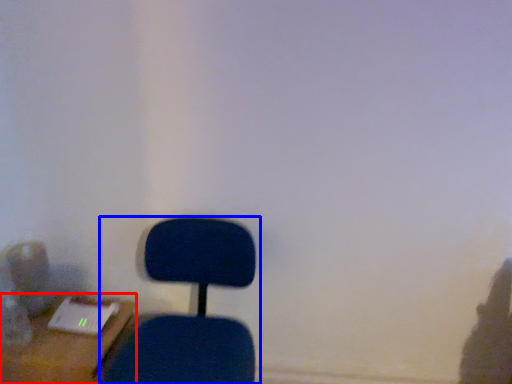
Question: Which object appears closest to the camera in this image, furniture (highlighted by a red box) or chair (highlighted by a blue box)?

Choices:
 (A) furniture
 (B) chair

Answer: (B)